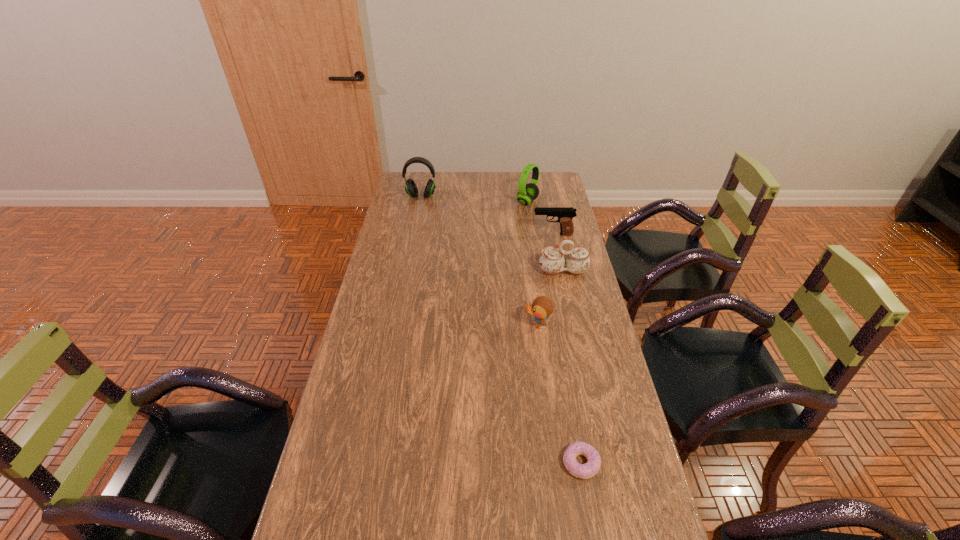
Where is `vacant space positioned 0.280m at the barrel of the pistol`? The image size is (960, 540). vacant space positioned 0.280m at the barrel of the pistol is located at coordinates (467, 234).

Image resolution: width=960 pixels, height=540 pixels. I want to click on free space located at the barrel of the pistol, so click(520, 234).

Image resolution: width=960 pixels, height=540 pixels. I want to click on blank area located 0.320m at the barrel of the pistol, so click(x=457, y=234).

I want to click on free space located on the front-facing side of the second nearest object, so click(407, 325).

The width and height of the screenshot is (960, 540). Find the location of `vacant space situated on the front-facing side of the second nearest object`. vacant space situated on the front-facing side of the second nearest object is located at coordinates (425, 325).

Identify the location of free spot located 0.170m on the front-facing side of the second nearest object. The height and width of the screenshot is (540, 960). (473, 325).

Find the location of a particular element. The height and width of the screenshot is (540, 960). vacant area situated on the back of the doughnut is located at coordinates (568, 390).

This screenshot has width=960, height=540. Find the location of `object at the left edge`. object at the left edge is located at coordinates (411, 189).

Locate an element on the screen. The height and width of the screenshot is (540, 960). headset that is at the right edge is located at coordinates 527,193.

What are the coordinates of `chinaware that is at the right edge` in the screenshot? It's located at (552, 261).